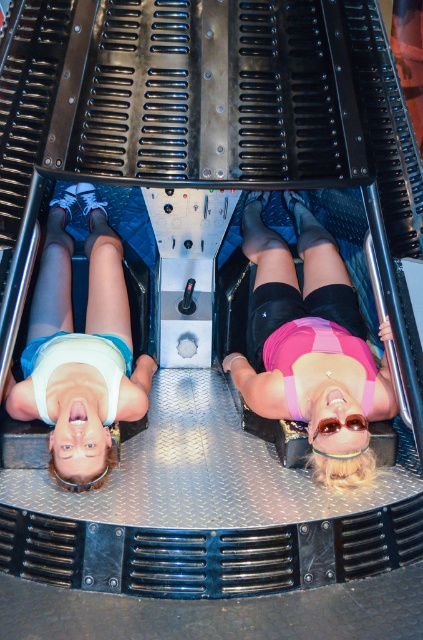
Between pink matte fabric at center and white matte tank top at upper center, which one is positioned lower?

white matte tank top at upper center is below.

Is point (271, 355) positioned in front of point (57, 333)?

Yes, it is.

Find the location of a particular element. Image resolution: width=423 pixels, height=640 pixels. pink matte fabric at center is located at coordinates (310, 346).